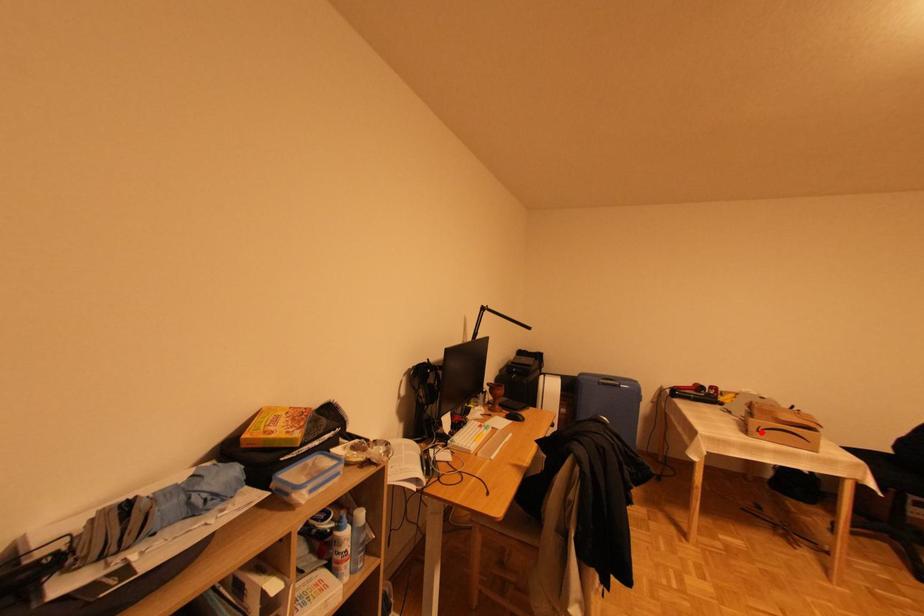
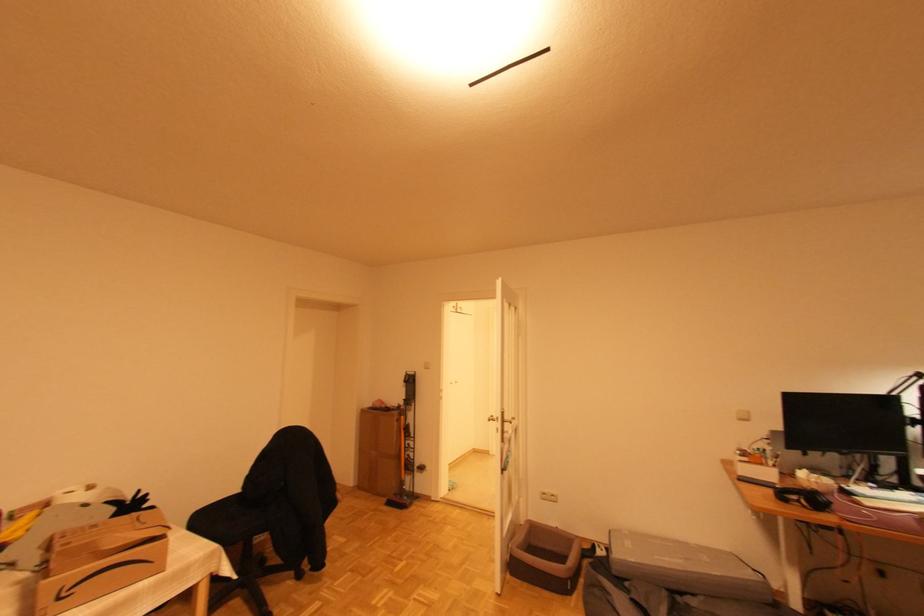
Question: I am providing you with two images of the same scene from different viewpoints. In image1, a red point is highlighted. Considering the same 3D point in image2, which of the following is correct?

Choices:
 (A) It is closer
 (B) It is farther

Answer: (A)